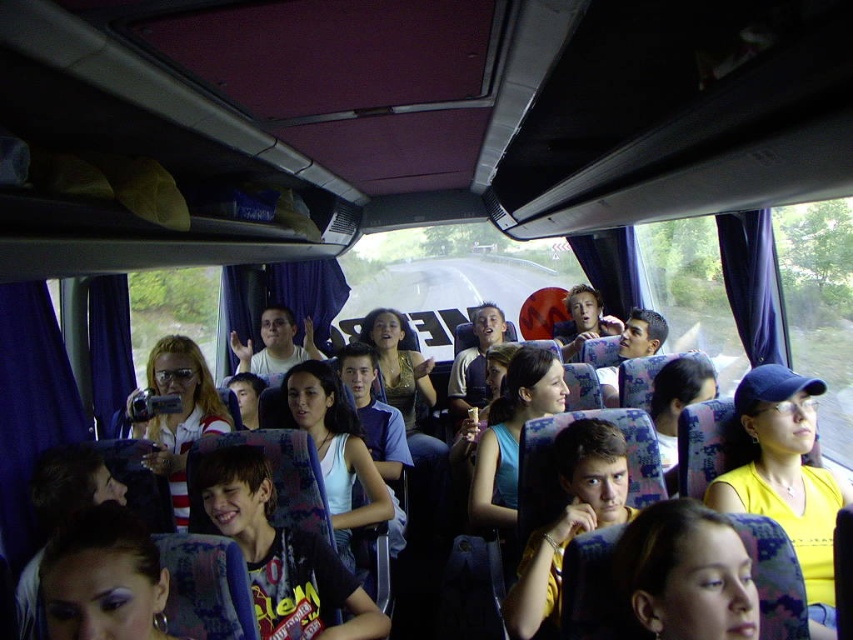
Question: Does yellow matte shirt at center have a smaller size compared to smooth yellow shirt at lower right?

Choices:
 (A) yes
 (B) no

Answer: (B)

Question: Which of the following is the closest to the observer?

Choices:
 (A) (662, 579)
 (B) (827, 544)

Answer: (A)

Question: Which of the following is the farthest from the observer?

Choices:
 (A) yellow matte shirt at center
 (B) smooth yellow shirt at lower right

Answer: (A)

Question: Does yellow matte shirt at center appear over smooth yellow shirt at lower right?

Choices:
 (A) yes
 (B) no

Answer: (B)

Question: Which point appears farthest from the camera in this image?

Choices:
 (A) (828, 531)
 (B) (682, 589)

Answer: (A)

Question: Does yellow matte shirt at center appear on the left side of smooth yellow shirt at lower right?

Choices:
 (A) no
 (B) yes

Answer: (A)